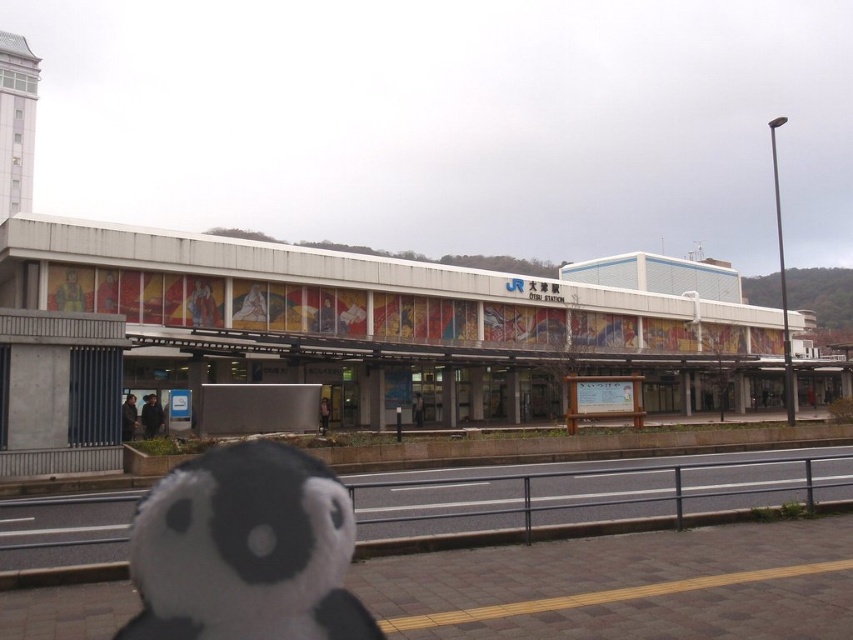
Is white plush at lower left positioned before black rubber train track at lower left?

Yes, it is in front of black rubber train track at lower left.

Can you confirm if white plush at lower left is positioned above black rubber train track at lower left?

Indeed, white plush at lower left is positioned over black rubber train track at lower left.

Does point (259, 534) come behind point (576, 481)?

No.

The height and width of the screenshot is (640, 853). What are the coordinates of `white plush at lower left` in the screenshot? It's located at (245, 550).